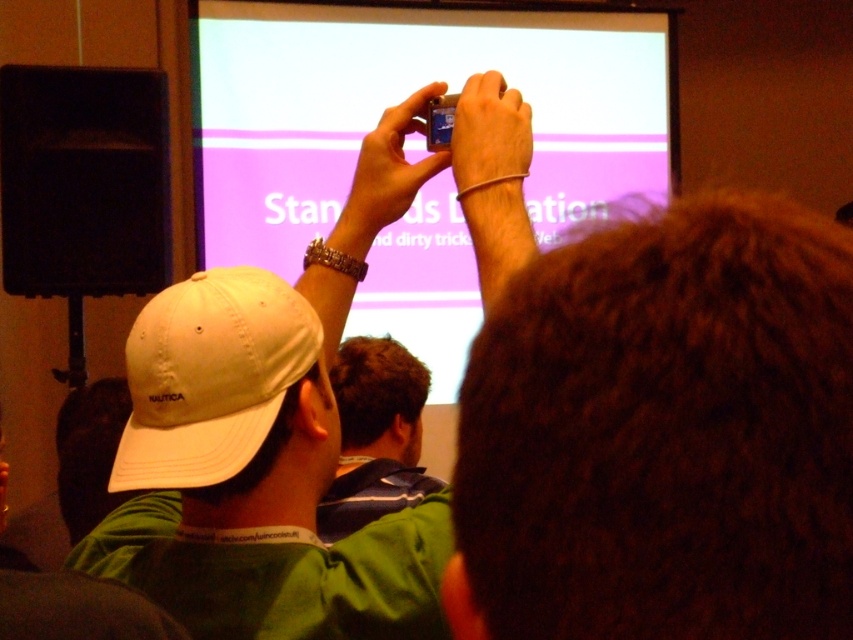
You are standing in the presentation room and see two points on the screen. The first point is at coordinates point (579, 170) and the second is at point (352, 365). Which point is closer to you?

Point (579, 170) is behind point (352, 365), so the point closer to you is point (352, 365).